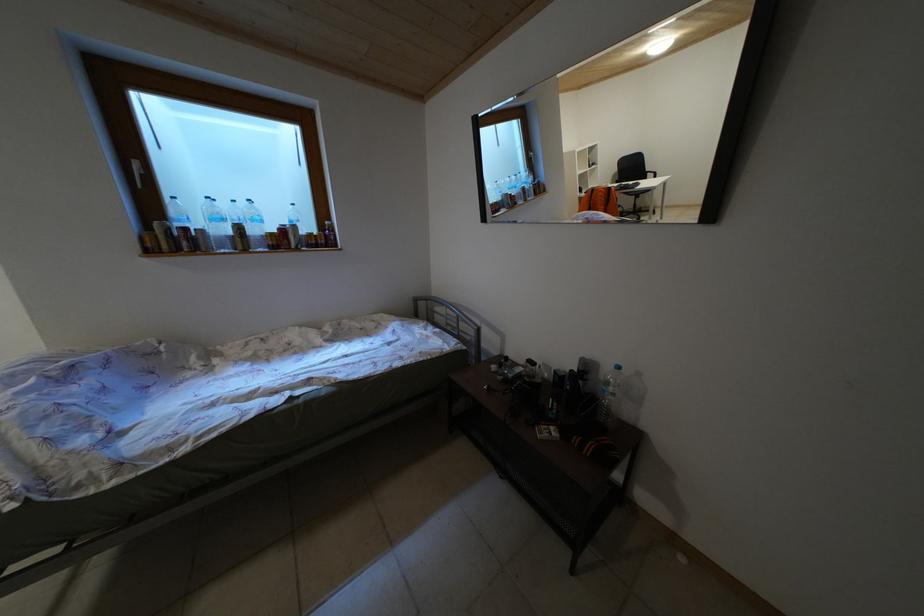
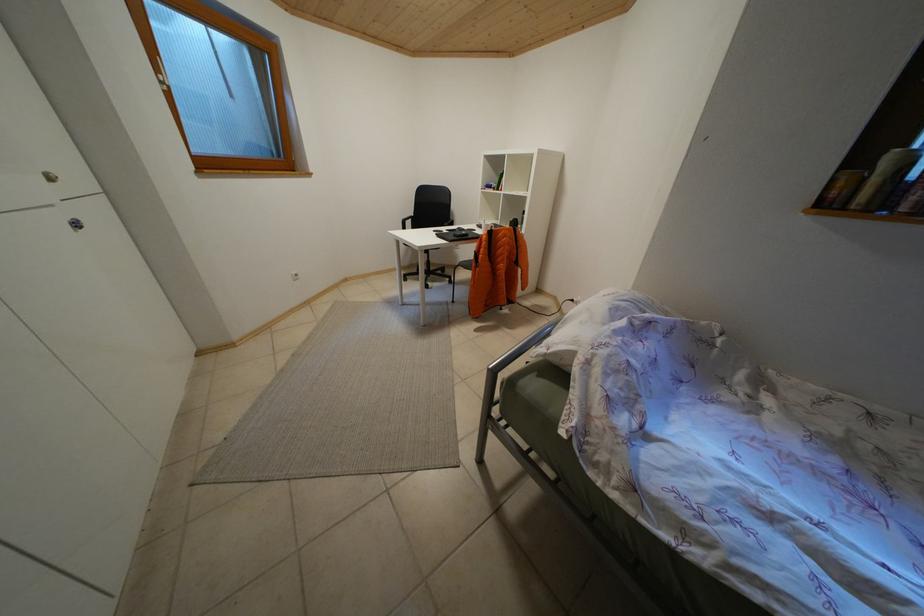
Based on the continuous images, in which direction is the camera rotating?

The camera's rotation is toward left-down.